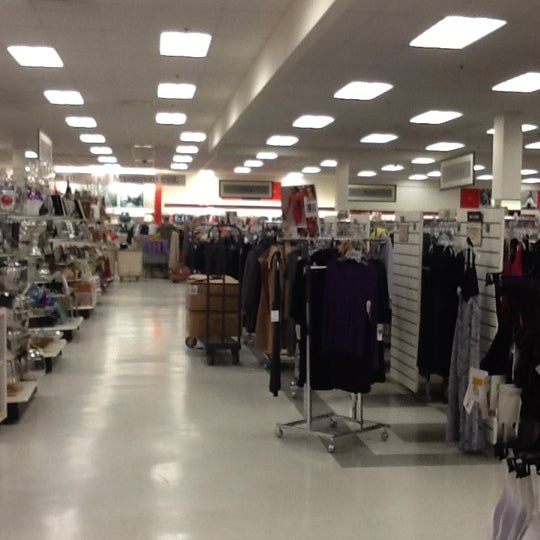
Where is `painted stripe`? painted stripe is located at coordinates (357, 459), (425, 433), (387, 397).